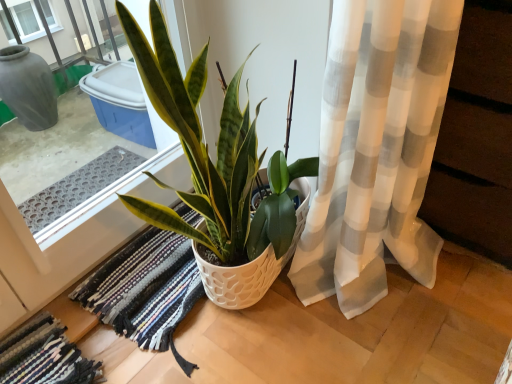
Question: Does point (94, 289) appear closer or farther from the camera than point (64, 342)?

Choices:
 (A) closer
 (B) farther

Answer: (B)

Question: From a real-world perspective, is multicolored woven rug at center, the 1th bath mat from the right, above or below multicolored woven rug at lower left, which ranks as the 1th bath mat in left-to-right order?

Choices:
 (A) below
 (B) above

Answer: (A)

Question: Which is farther from the multicolored woven rug at center, the 1th bath mat from the right?

Choices:
 (A) multicolored woven rug at lower left, which is the second bath mat in right-to-left order
 (B) green glossy plant at center

Answer: (B)

Question: Which object is positioned farthest from the multicolored woven rug at lower left, which ranks as the 1th bath mat in left-to-right order?

Choices:
 (A) green glossy plant at center
 (B) multicolored woven rug at center, the 1th bath mat from the right

Answer: (A)